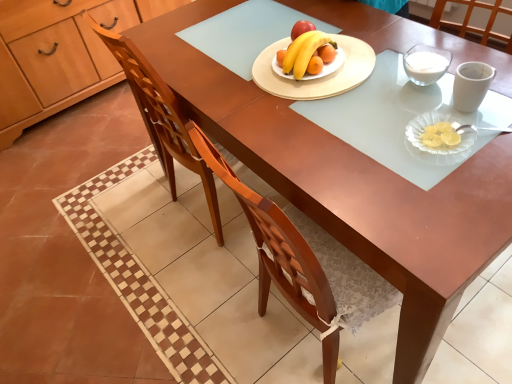
Question: Would you say wooden cabinet at left contains clear glass platter at lower right, which appears as the second platter when viewed from the left?

Choices:
 (A) no
 (B) yes

Answer: (A)

Question: Can you confirm if wooden cabinet at left is smaller than clear glass platter at lower right, which appears as the second platter when viewed from the left?

Choices:
 (A) no
 (B) yes

Answer: (A)

Question: Is wooden cabinet at left to the left of clear glass platter at lower right, which appears as the second platter when viewed from the left, from the viewer's perspective?

Choices:
 (A) no
 (B) yes

Answer: (B)

Question: Is wooden cabinet at left wider than clear glass platter at lower right, positioned as the first platter in front-to-back order?

Choices:
 (A) yes
 (B) no

Answer: (A)

Question: From a real-world perspective, is wooden cabinet at left beneath clear glass platter at lower right, positioned as the 2th platter in top-to-bottom order?

Choices:
 (A) no
 (B) yes

Answer: (B)

Question: Is wooden cabinet at left not within clear glass platter at lower right, which is the first platter from bottom to top?

Choices:
 (A) yes
 (B) no

Answer: (A)

Question: Is wooden chair at center smaller than wooden cabinet at left?

Choices:
 (A) no
 (B) yes

Answer: (B)

Question: Is wooden chair at center taller than wooden cabinet at left?

Choices:
 (A) yes
 (B) no

Answer: (A)

Question: Considering the relative sizes of wooden chair at center and wooden cabinet at left in the image provided, is wooden chair at center bigger than wooden cabinet at left?

Choices:
 (A) no
 (B) yes

Answer: (A)

Question: Is wooden chair at center facing towards wooden cabinet at left?

Choices:
 (A) no
 (B) yes

Answer: (A)

Question: Can wooden cabinet at left be found inside wooden chair at center?

Choices:
 (A) no
 (B) yes

Answer: (A)

Question: Can you confirm if wooden chair at center is wider than wooden cabinet at left?

Choices:
 (A) yes
 (B) no

Answer: (A)

Question: Is yellow matte banana at center directly adjacent to wooden cabinet at left?

Choices:
 (A) no
 (B) yes

Answer: (A)